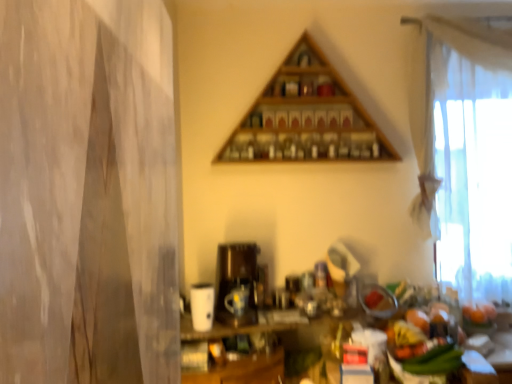
Question: Is matte black coffee machine at center far away from white sheer curtain at right?

Choices:
 (A) no
 (B) yes

Answer: (B)

Question: Does matte black coffee machine at center turn towards white sheer curtain at right?

Choices:
 (A) no
 (B) yes

Answer: (A)

Question: Is matte black coffee machine at center positioned in front of white sheer curtain at right?

Choices:
 (A) no
 (B) yes

Answer: (B)

Question: From a real-world perspective, is matte black coffee machine at center beneath white sheer curtain at right?

Choices:
 (A) no
 (B) yes

Answer: (B)

Question: Can you confirm if matte black coffee machine at center is shorter than white sheer curtain at right?

Choices:
 (A) yes
 (B) no

Answer: (A)

Question: Does matte black coffee machine at center appear on the right side of white sheer curtain at right?

Choices:
 (A) yes
 (B) no

Answer: (B)

Question: Is matte black coffee machine at center oriented away from wooden triangle at upper center?

Choices:
 (A) yes
 (B) no

Answer: (B)

Question: From a real-world perspective, does matte black coffee machine at center sit lower than wooden triangle at upper center?

Choices:
 (A) yes
 (B) no

Answer: (A)

Question: Is matte black coffee machine at center positioned before wooden triangle at upper center?

Choices:
 (A) no
 (B) yes

Answer: (B)

Question: Can you confirm if matte black coffee machine at center is positioned to the left of wooden triangle at upper center?

Choices:
 (A) no
 (B) yes

Answer: (B)

Question: Considering the relative positions of matte black coffee machine at center and wooden triangle at upper center in the image provided, is matte black coffee machine at center to the right of wooden triangle at upper center from the viewer's perspective?

Choices:
 (A) no
 (B) yes

Answer: (A)

Question: Can you confirm if matte black coffee machine at center is shorter than wooden triangle at upper center?

Choices:
 (A) no
 (B) yes

Answer: (B)

Question: Would you say white sheer curtain at right is a long distance from matte black coffee machine at center?

Choices:
 (A) no
 (B) yes

Answer: (B)